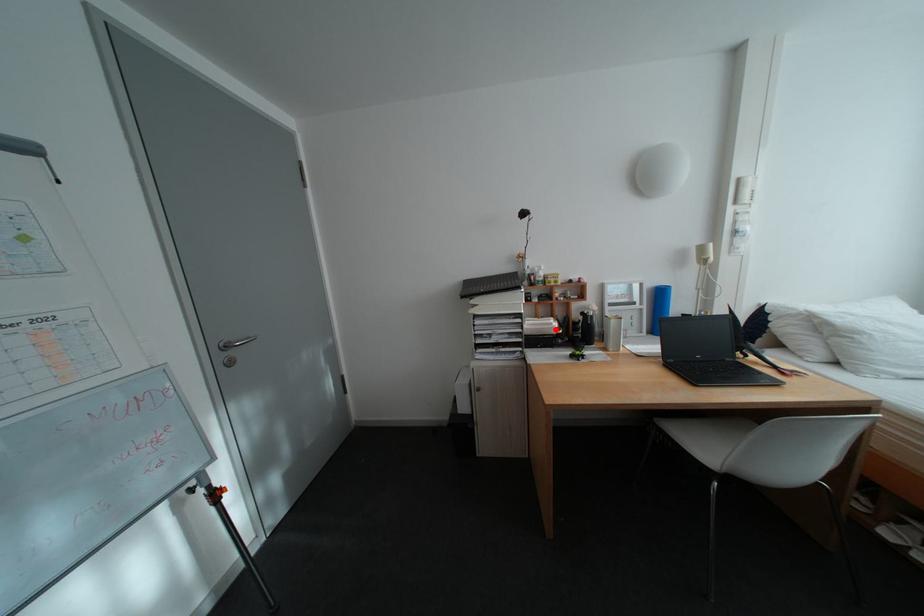
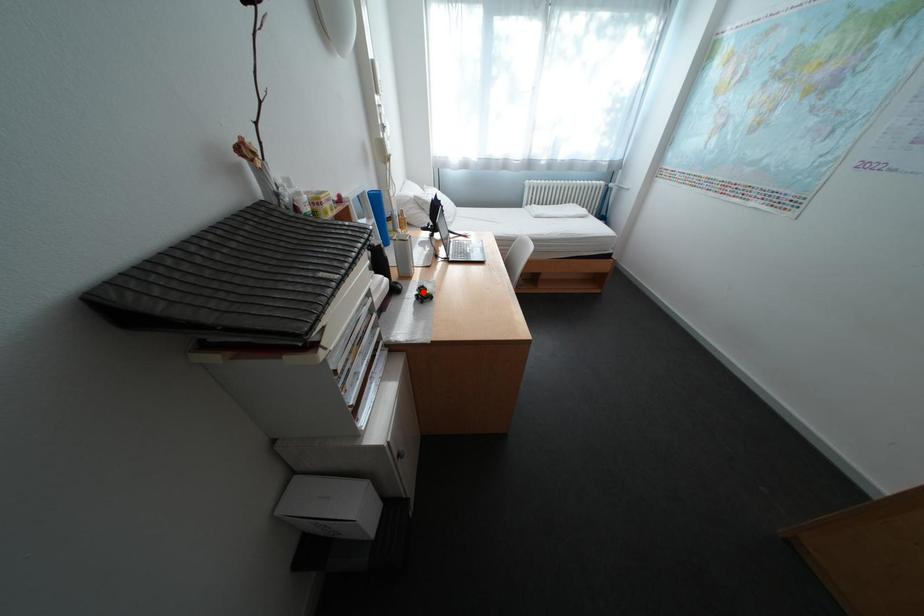
I am providing you with two images of the same scene from different viewpoints. A red point is marked on the first image and another point is marked on the second image. Is the red point in image1 aligned with the point shown in image2?

No